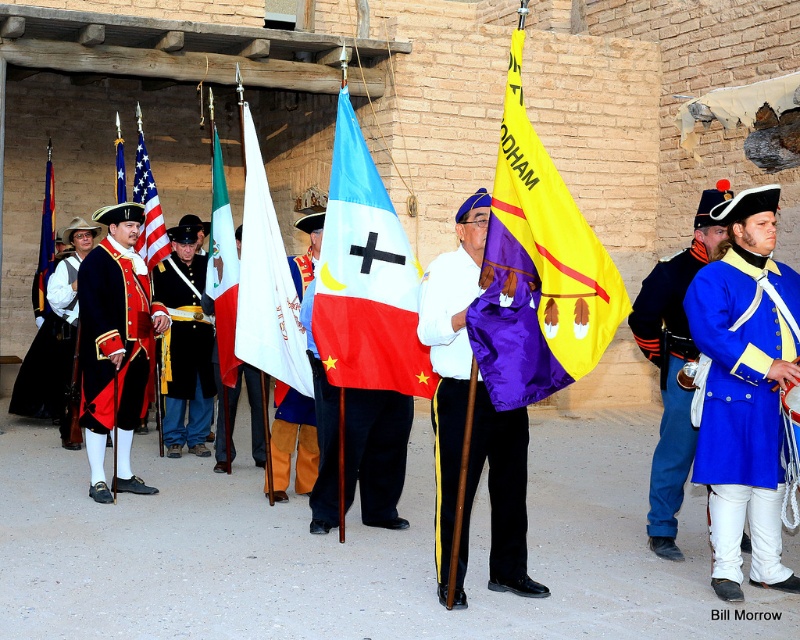
You are a photographer at the historical reenactment. You need to capture a photo where both the yellowpolyesterflag at center and the white cotton flag at center are visible. Based on their heights, which flag will appear taller in the photo?

The white cotton flag at center appears taller in the photo because it has a greater height than the yellowpolyesterflag at center according to the description.

You are a guest at this historical reenactment. You notice two blue fabric flags in the scene. The first is the blue fabric flag with white cross at center, and the second is the blue fabric flag at center. Which flag is positioned lower in the image?

The blue fabric flag with white cross at center is positioned lower than the blue fabric flag at center.

You are a soldier in the reenactment and need to determine which flag is larger in width between the blue fabric flag with white cross at center and the blue fabric flag at center based on the scene. Which one is wider?

The blue fabric flag with white cross at center might be wider than blue fabric flag at center according to the description.